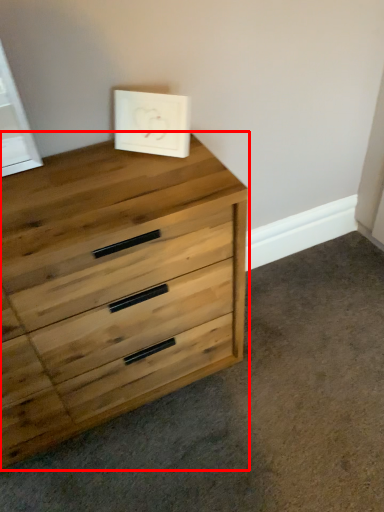
Question: From the image's perspective, where is chest of drawers (annotated by the red box) located in relation to picture frame in the image?

Choices:
 (A) above
 (B) below

Answer: (B)